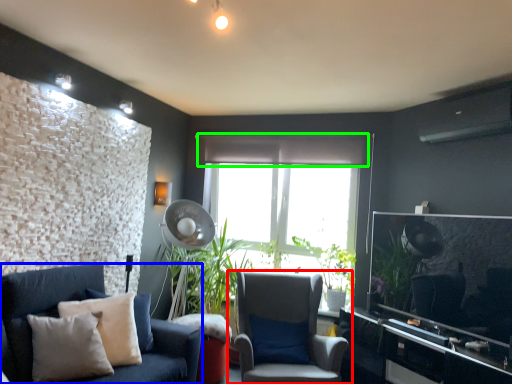
Question: Considering the real-world distances, which object is farthest from chair (highlighted by a red box)? studio couch (highlighted by a blue box) or curtain (highlighted by a green box)?

Choices:
 (A) studio couch
 (B) curtain

Answer: (B)